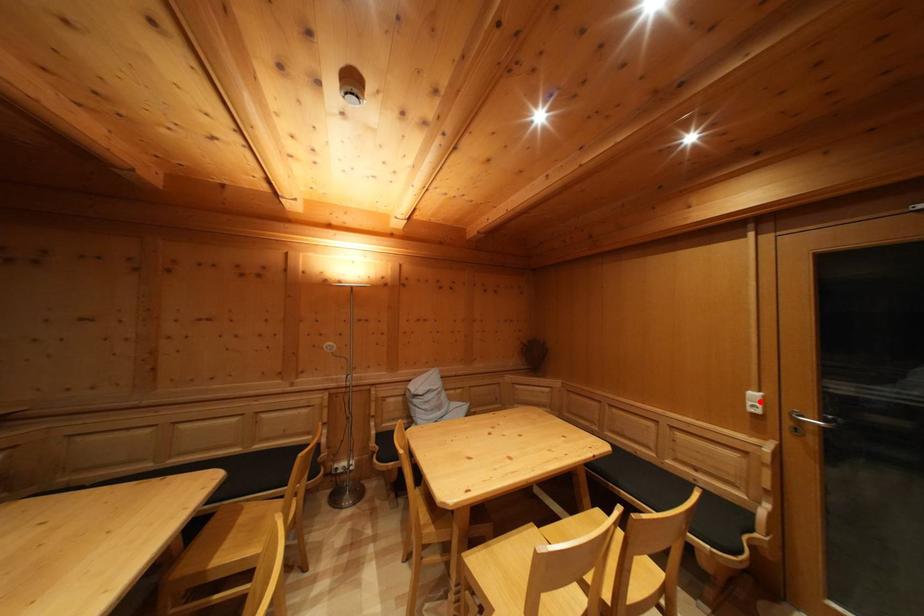
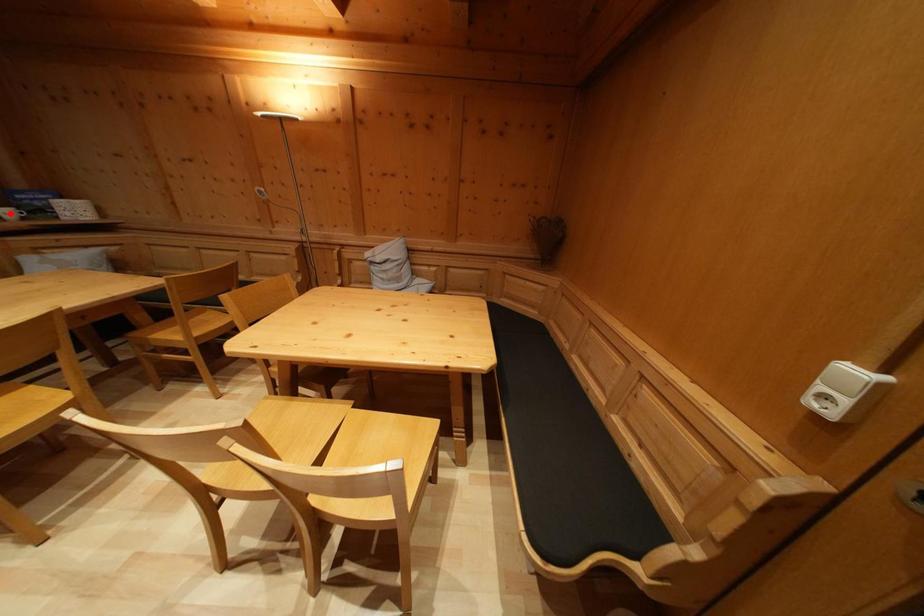
I am providing you with two images of the same scene from different viewpoints. A red point is marked on the first image and another point is marked on the second image. Is the red point in image1 aligned with the point shown in image2?

No